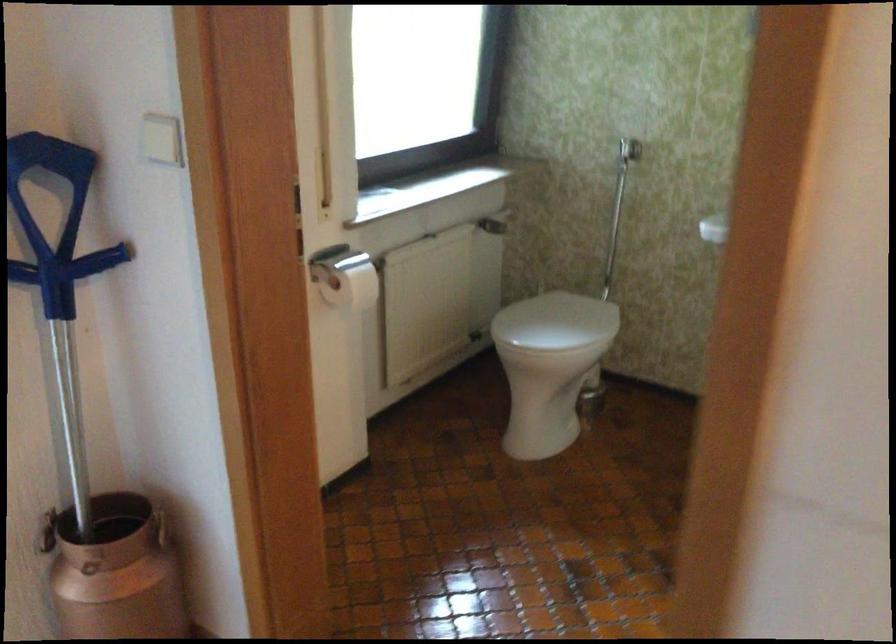
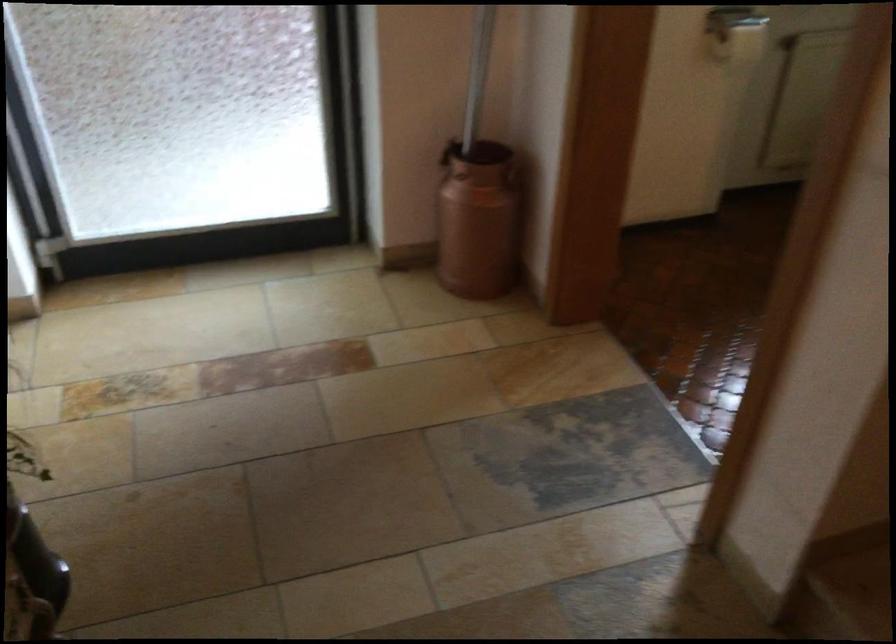
Locate, in the second image, the point that corresponds to (x=175, y=536) in the first image.

(513, 176)